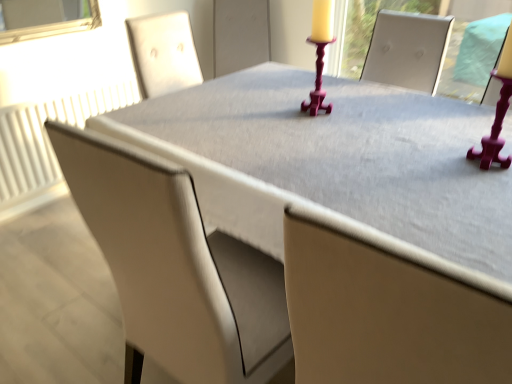
Image resolution: width=512 pixels, height=384 pixels. Find the location of `blank space above white textured radiator at left (from a real-world perspective)`. blank space above white textured radiator at left (from a real-world perspective) is located at coordinates (57, 91).